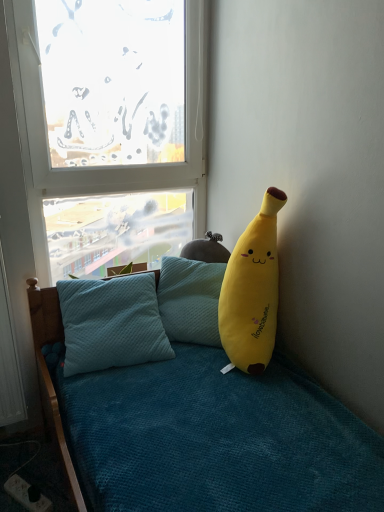
Question: Is point (26, 169) positioned closer to the camera than point (261, 258)?

Choices:
 (A) farther
 (B) closer

Answer: (A)

Question: Is transparent glass window at upper left inside the boundaries of yellow plush at right, or outside?

Choices:
 (A) outside
 (B) inside

Answer: (A)

Question: Estimate the real-world distances between objects in this image. Which object is farther from the yellow plush at right?

Choices:
 (A) black plastic power outlet at lower left
 (B) transparent glass window at upper left

Answer: (A)

Question: Which object is positioned farthest from the yellow plush at right?

Choices:
 (A) black plastic power outlet at lower left
 (B) transparent glass window at upper left

Answer: (A)